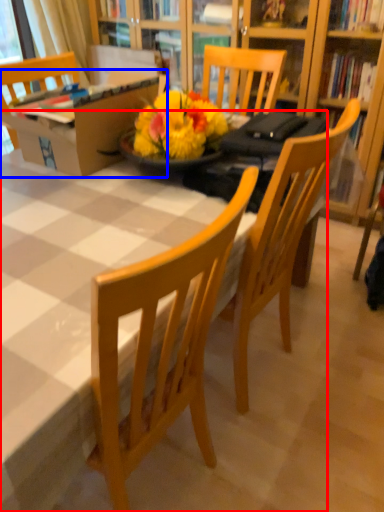
Question: Which object appears closest to the camera in this image, desk (highlighted by a red box) or box (highlighted by a blue box)?

Choices:
 (A) desk
 (B) box

Answer: (A)